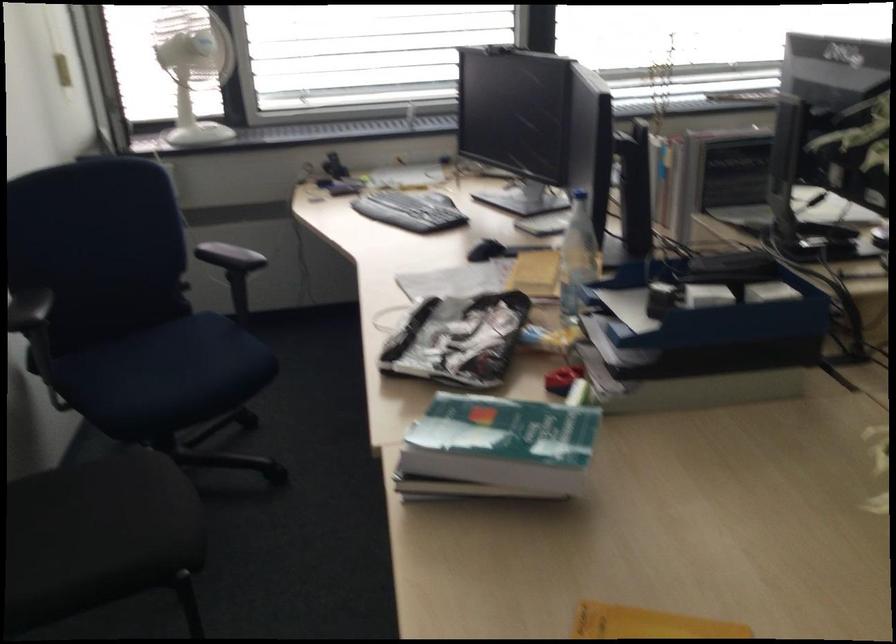
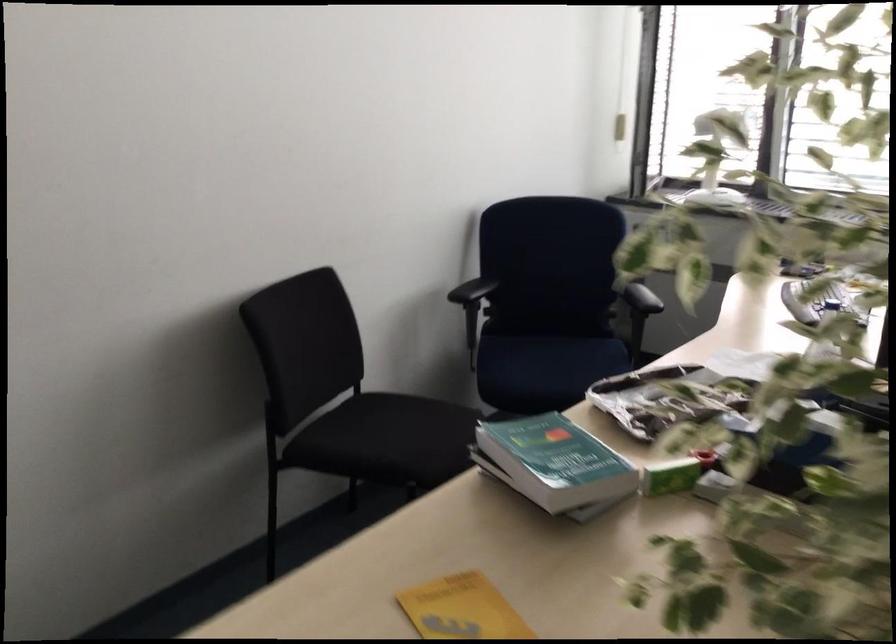
Where in the second image is the point corresponding to (515,433) from the first image?

(554, 462)